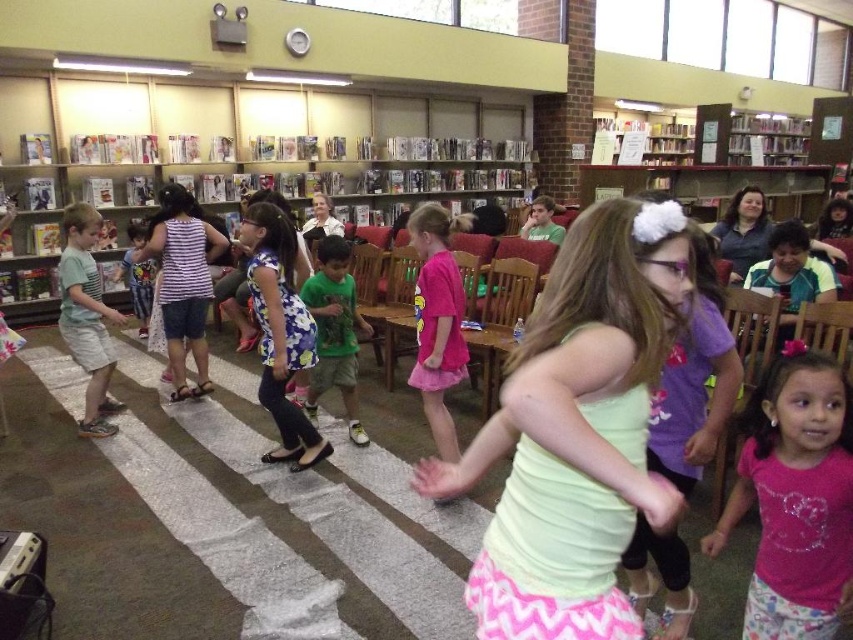
Is wooden chair at right wider than striped fabric shirt at center?

In fact, wooden chair at right might be narrower than striped fabric shirt at center.

Does wooden chair at right come in front of striped fabric shirt at center?

Yes.

Who is more forward, (770, 326) or (126, 282)?

Point (770, 326)

What are the coordinates of `wooden chair at right` in the screenshot? It's located at click(751, 332).

Is light green jersey at center closer to camera compared to pink fabric shirt at lower right?

Yes, light green jersey at center is closer to the viewer.

The height and width of the screenshot is (640, 853). What do you see at coordinates (576, 433) in the screenshot?
I see `light green jersey at center` at bounding box center [576, 433].

This screenshot has height=640, width=853. What are the coordinates of `light green jersey at center` in the screenshot? It's located at (576, 433).

Who is more distant from viewer, [758,467] or [32,269]?

The point [32,269] is more distant.

Which of these two, pink fabric shirt at lower right or wooden bookshelf at center, stands taller?

Standing taller between the two is pink fabric shirt at lower right.

Is point (776, 476) less distant than point (378, 218)?

That is True.

The width and height of the screenshot is (853, 640). I want to click on pink fabric shirt at lower right, so click(795, 497).